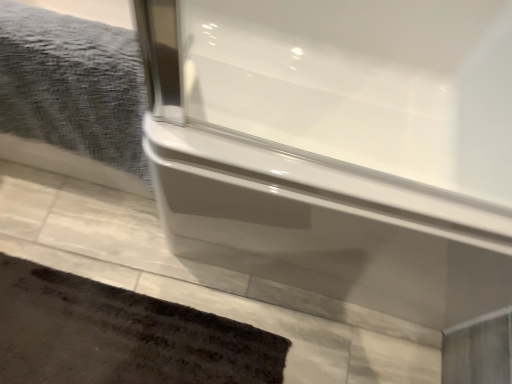
Image resolution: width=512 pixels, height=384 pixels. Find the location of `free point above dark brown textured bath mat at lower left (from a real-world perspective)`. free point above dark brown textured bath mat at lower left (from a real-world perspective) is located at coordinates (111, 338).